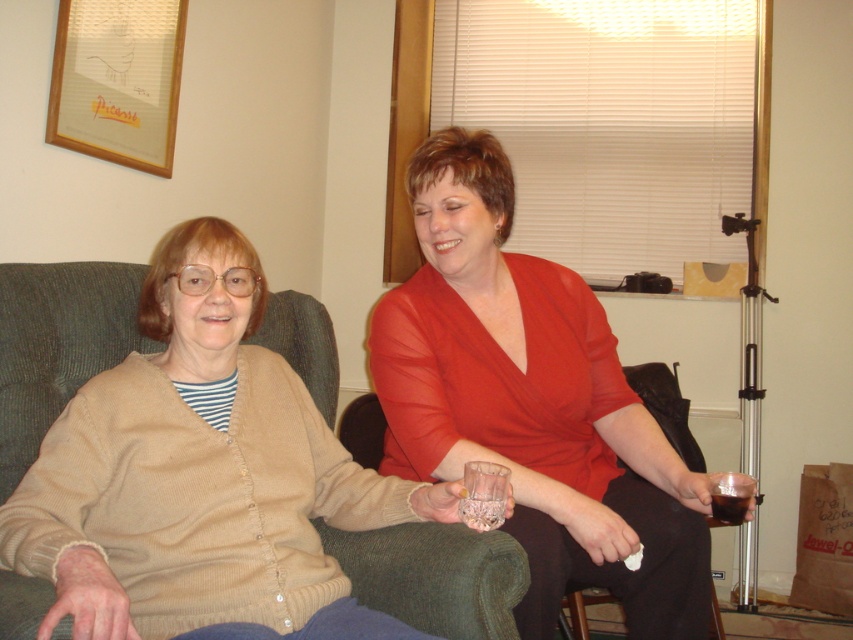
The width and height of the screenshot is (853, 640). Describe the element at coordinates (532, 403) in the screenshot. I see `matte glass at center` at that location.

Is matte glass at center positioned at the back of beige knit cardigan at center?

Yes, matte glass at center is further from the viewer.

Is point (486, 369) in front of point (55, 394)?

No, (486, 369) is behind (55, 394).

Where is `matte glass at center`? matte glass at center is located at coordinates (532, 403).